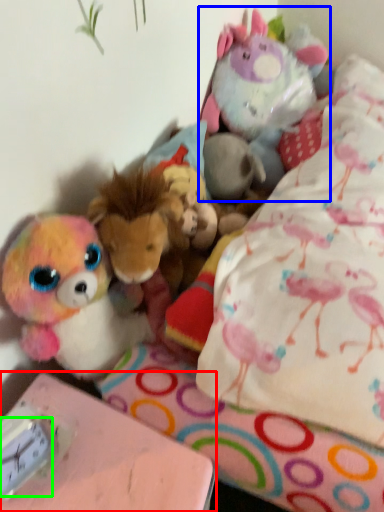
Question: Which object is the farthest from table (highlighted by a red box)? Choose among these: toy (highlighted by a blue box) or clock (highlighted by a green box).

Choices:
 (A) toy
 (B) clock

Answer: (A)